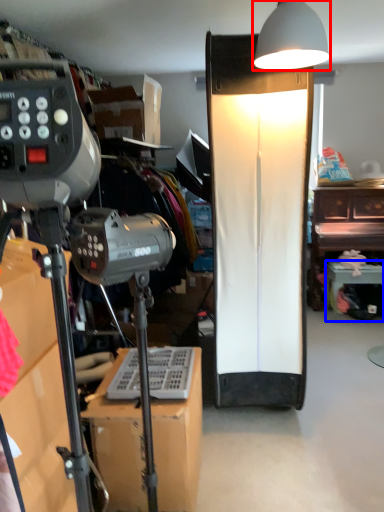
Question: Among these objects, which one is nearest to the camera, lamp (highlighted by a red box) or furniture (highlighted by a blue box)?

Choices:
 (A) lamp
 (B) furniture

Answer: (A)